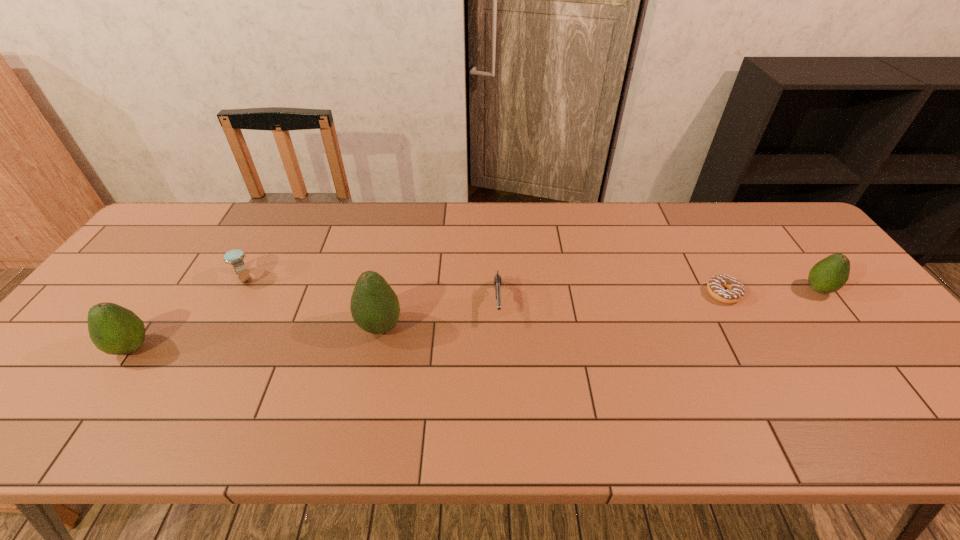
In order to click on doughnut in this screenshot , I will do `click(735, 291)`.

Locate an element on the screen. This screenshot has width=960, height=540. vacant space located on the back of the second tallest avocado is located at coordinates (183, 274).

Find the location of `vacant space located on the right of the second avocado from right to left`. vacant space located on the right of the second avocado from right to left is located at coordinates (517, 327).

Where is `free space located on the back of the rightmost object`? Image resolution: width=960 pixels, height=540 pixels. free space located on the back of the rightmost object is located at coordinates (780, 240).

The image size is (960, 540). I want to click on vacant area located 0.090m on the back of the watch, so click(261, 247).

Locate an element on the screen. vacant region located aiming along the barrel of the gun is located at coordinates (501, 395).

Where is `free spot located 0.180m on the front of the shortest object`? Image resolution: width=960 pixels, height=540 pixels. free spot located 0.180m on the front of the shortest object is located at coordinates (761, 362).

At what (x,y) coordinates should I click in order to perform the action: click on object located at the left edge. Please return your answer as a coordinate pair (x, y). Looking at the image, I should click on (115, 330).

Where is `object situated at the right edge`? The width and height of the screenshot is (960, 540). object situated at the right edge is located at coordinates (830, 274).

Locate an element on the screen. The width and height of the screenshot is (960, 540). free region at the far edge of the desktop is located at coordinates (258, 232).